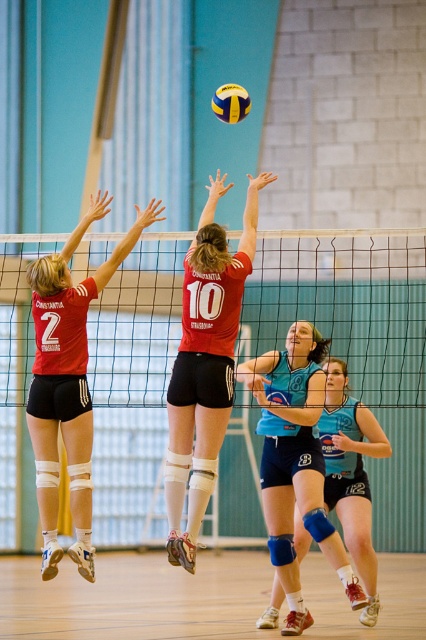
Is teal jersey at center below yellow matte/vinyl volleyball at center?

Correct, teal jersey at center is located below yellow matte/vinyl volleyball at center.

Does teal jersey at center have a lesser width compared to yellow matte/vinyl volleyball at center?

No, teal jersey at center is not thinner than yellow matte/vinyl volleyball at center.

Between point (279, 573) and point (229, 116), which one is positioned in front?

Point (229, 116)

Locate an element on the screen. The image size is (426, 640). teal jersey at center is located at coordinates (296, 461).

Looking at this image, can you confirm if matte red shorts at center is smaller than matte black shorts at upper left?

No, matte red shorts at center is not smaller than matte black shorts at upper left.

Between point (178, 365) and point (71, 349), which one is positioned in front?

Positioned in front is point (178, 365).

Identify the location of matte red shorts at center. (204, 364).

Image resolution: width=426 pixels, height=640 pixels. I want to click on matte red shorts at center, so click(x=204, y=364).

Which is in front, point (138, 305) or point (333, 525)?

Positioned in front is point (333, 525).

Does white mesh net at center come in front of teal jersey at center?

Yes.

In order to click on white mesh net at center in this screenshot , I will do `click(345, 304)`.

Locate an element on the screen. The height and width of the screenshot is (640, 426). white mesh net at center is located at coordinates (345, 304).